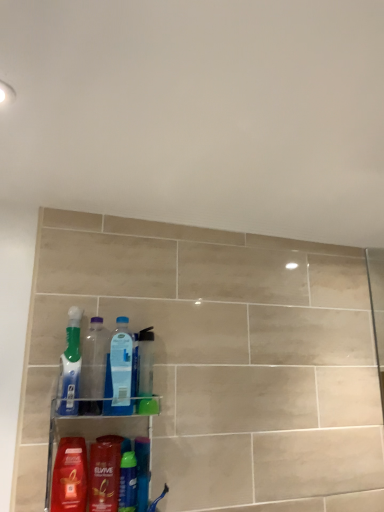
Question: Does point (125, 492) appear closer or farther from the camera than point (82, 388)?

Choices:
 (A) farther
 (B) closer

Answer: (B)

Question: Considering the positions of translucent plastic bottle at lower center and transparent plastic bottle at center, placed as the first bottle when sorted from left to right, in the image, is translucent plastic bottle at lower center wider or thinner than transparent plastic bottle at center, placed as the first bottle when sorted from left to right,?

Choices:
 (A) wide
 (B) thin

Answer: (B)

Question: Estimate the real-world distances between objects in this image. Which object is farther from the shiny red shampoo at lower left, which ranks as the first cleaning product in bottom-to-top order?

Choices:
 (A) translucent plastic bottle at lower center
 (B) transparent plastic bottle at center, marked as the 2th bottle in a right-to-left arrangement
 (C) translucent plastic bottles at lower center
 (D) translucent plastic toothbrush at left, which is counted as the 2th cleaning product, starting from the bottom
 (E) transparent plastic bottle at center, marked as the second bottle in a left-to-right arrangement

Answer: (E)

Question: Which of these objects is positioned closest to the transparent plastic bottle at center, positioned as the first bottle in right-to-left order?

Choices:
 (A) transparent plastic bottle at center, placed as the first bottle when sorted from left to right
 (B) translucent plastic bottles at lower center
 (C) translucent plastic mouthwash at lower center, the first mouthwash from the left
 (D) shiny red shampoo at lower left, which appears as the second cleaning product when viewed from the top
 (E) translucent plastic toothbrush at left, positioned as the first cleaning product in top-to-bottom order

Answer: (A)